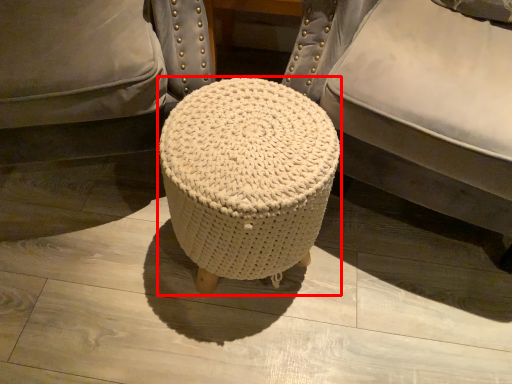
Question: From the image, what is the correct spatial relationship of stool (annotated by the red box) in relation to furniture?

Choices:
 (A) left
 (B) right

Answer: (A)